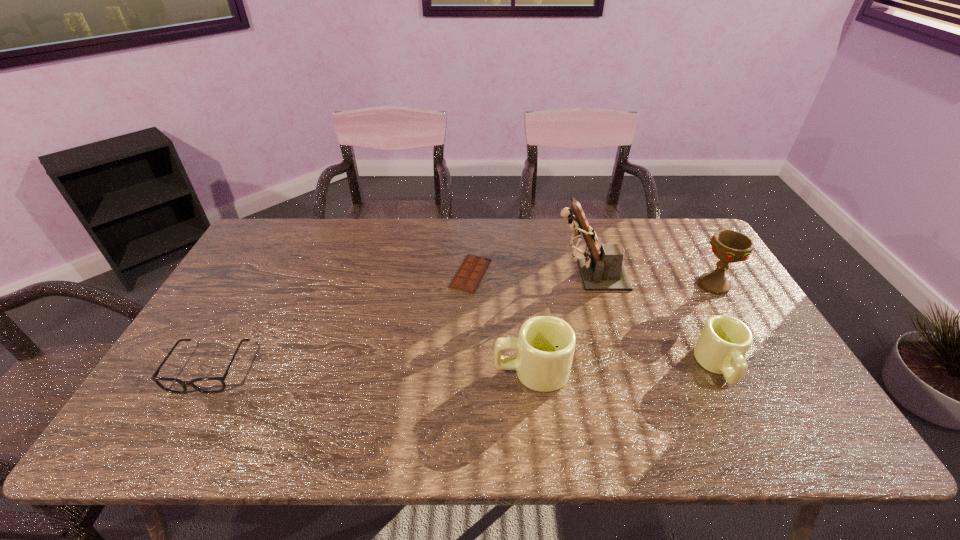
I want to click on the fourth shortest object, so click(x=545, y=346).

I want to click on the left mug, so click(x=545, y=346).

Where is `the shorter mug`? The image size is (960, 540). the shorter mug is located at coordinates (724, 341).

Locate an element on the screen. Image resolution: width=960 pixels, height=540 pixels. the fifth object from left to right is located at coordinates (724, 341).

The height and width of the screenshot is (540, 960). In order to click on chocolate bar in this screenshot , I will do `click(468, 277)`.

Identify the location of the fifth shortest object. The width and height of the screenshot is (960, 540). (729, 246).

Identify the location of the rightmost object. The height and width of the screenshot is (540, 960). (729, 246).

Identify the location of the tallest object. This screenshot has width=960, height=540. (602, 269).

This screenshot has height=540, width=960. Identify the location of the third object from right to left. (602, 269).

Identify the location of the leftmost object. Image resolution: width=960 pixels, height=540 pixels. (209, 385).